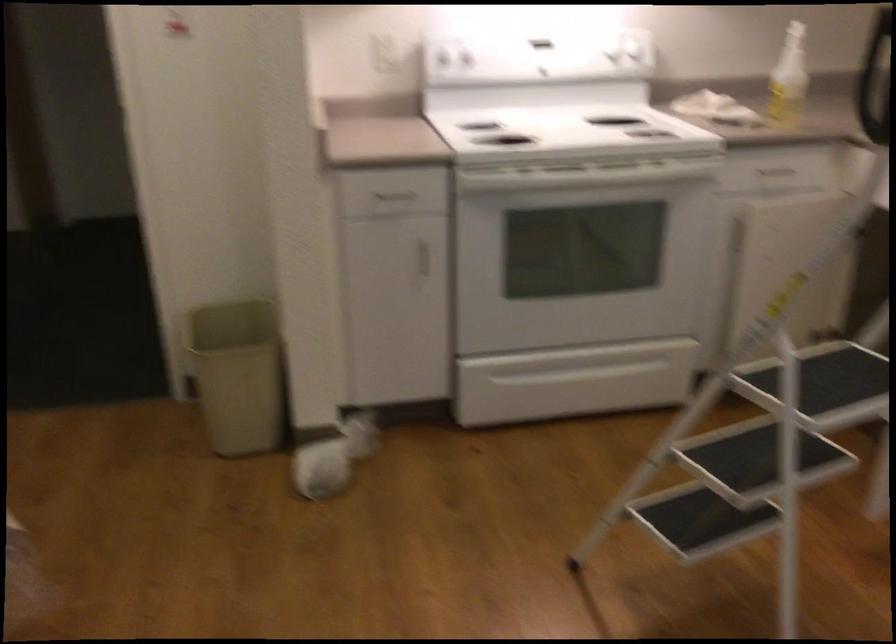
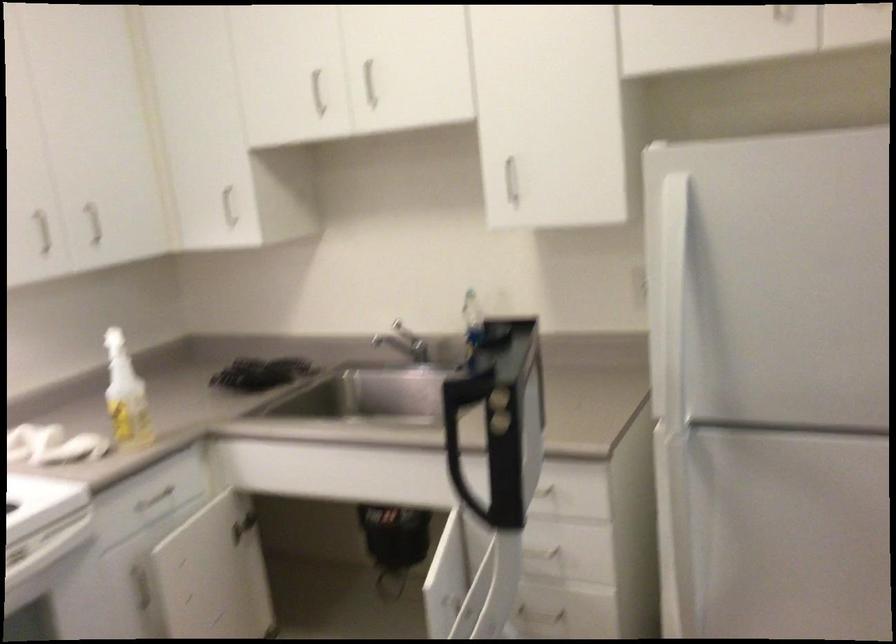
Question: The images are taken continuously from a first-person perspective. In which direction is your viewpoint rotating?

Choices:
 (A) Left
 (B) Right
 (C) Up
 (D) Down

Answer: (B)